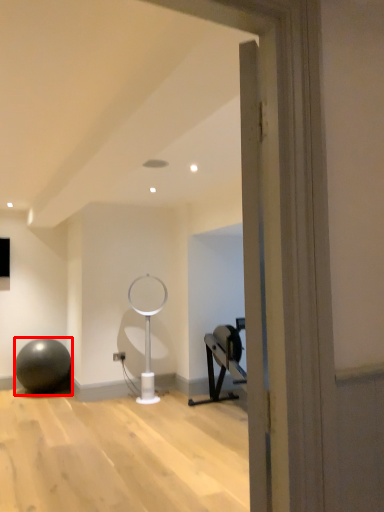
Question: From the image, what is the correct spatial relationship of ball (annotated by the red box) in relation to table lamp?

Choices:
 (A) right
 (B) left

Answer: (B)